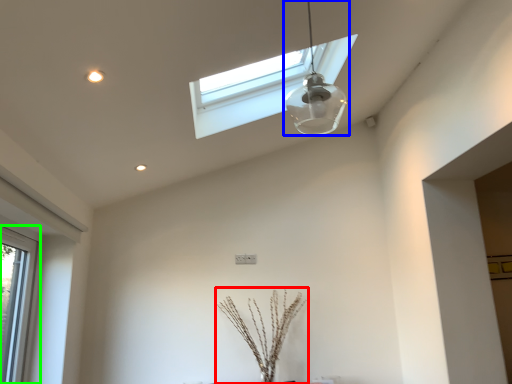
Question: Considering the real-world distances, which object is farthest from plant (highlighted by a red box)? lamp (highlighted by a blue box) or window (highlighted by a green box)?

Choices:
 (A) lamp
 (B) window

Answer: (A)